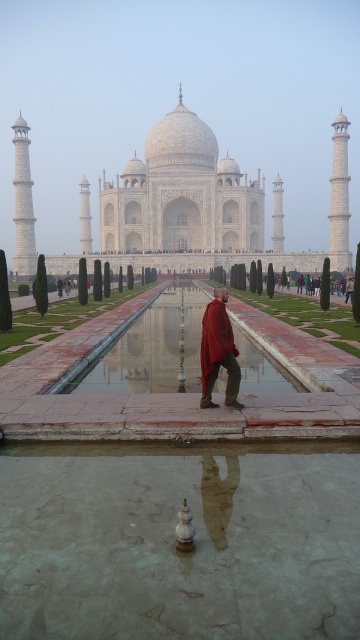
Consider the image. Does shiny reflective water at center lie in front of red velvet robe at center?

No, it is behind red velvet robe at center.

Does shiny reflective water at center appear on the right side of red velvet robe at center?

In fact, shiny reflective water at center is to the left of red velvet robe at center.

This screenshot has height=640, width=360. In order to click on shiny reflective water at center in this screenshot , I will do `click(150, 352)`.